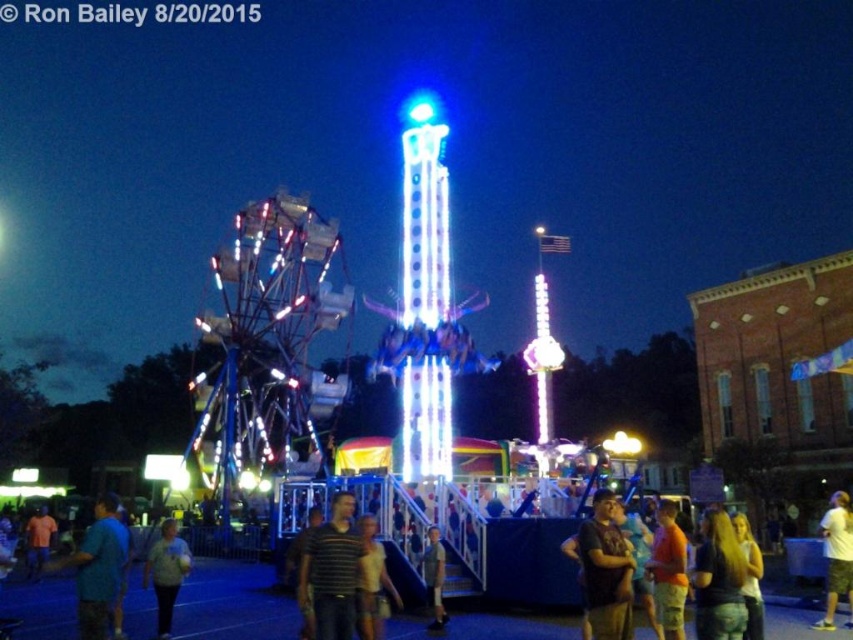
Question: Considering the relative positions of white cotton shirt at lower right and light brown leather jacket at center in the image provided, where is white cotton shirt at lower right located with respect to light brown leather jacket at center?

Choices:
 (A) above
 (B) below

Answer: (A)

Question: Which object is positioned farthest from the white cotton shirt at lower right?

Choices:
 (A) orange cotton shirt at lower right
 (B) light brown leather jacket at center
 (C) brown cotton shirt at center

Answer: (B)

Question: Estimate the real-world distances between objects in this image. Which object is farther from the yellow fabric shirt at center?

Choices:
 (A) light brown leather jacket at center
 (B) blonde hair at lower right

Answer: (B)

Question: Is striped shirt at center wider than white cotton shirt at lower right?

Choices:
 (A) yes
 (B) no

Answer: (B)

Question: Among these objects, which one is farthest from the camera?

Choices:
 (A) light blue shirt at lower left
 (B) yellow fabric shirt at center
 (C) blue cotton shirt at lower left
 (D) white cotton shirt at lower right

Answer: (D)

Question: Observing the image, what is the correct spatial positioning of blonde hair at lower right in reference to blue cotton shirt at lower left?

Choices:
 (A) right
 (B) left

Answer: (A)